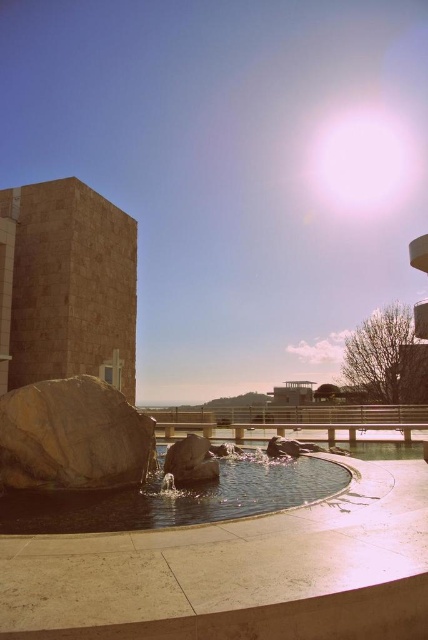
You are designing a garden layout and want to place a small bench between the rustic stone boulder at lower left and the smooth gray rock at center. Given the space between them, will the bench, which is 1.2 meters wide, fit comfortably without being crowded?

The rustic stone boulder at lower left is wider than the smooth gray rock at center. However, the exact distance between them isn